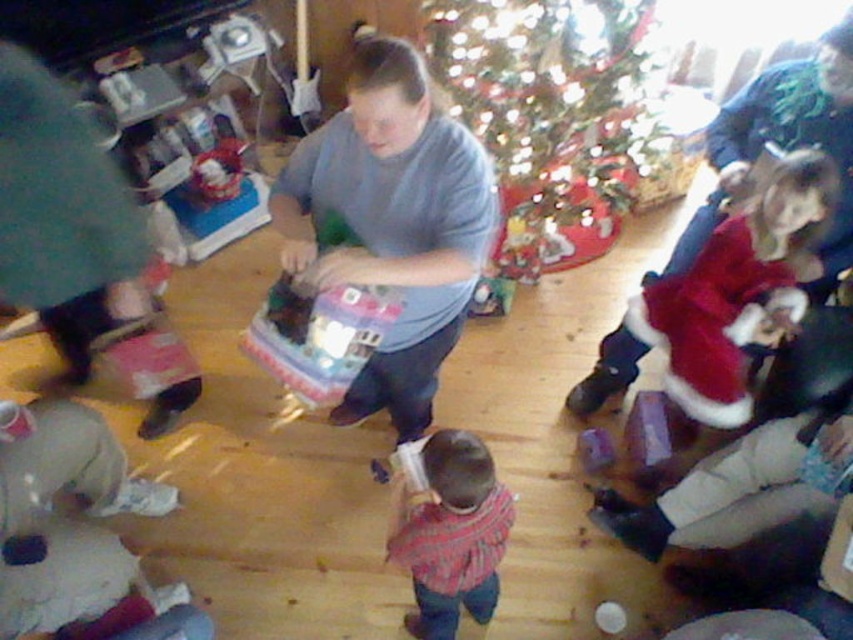
You are organizing a gift exchange and need to place a gift between the matte gray shirt at center and the plaid shirt at center. The gift box is 20 inches long. Will it fit between them?

The matte gray shirt at center and plaid shirt at center are 19.55 inches apart. The gift box is 20 inches long, so it will not fit between them since the distance is slightly shorter than the box.